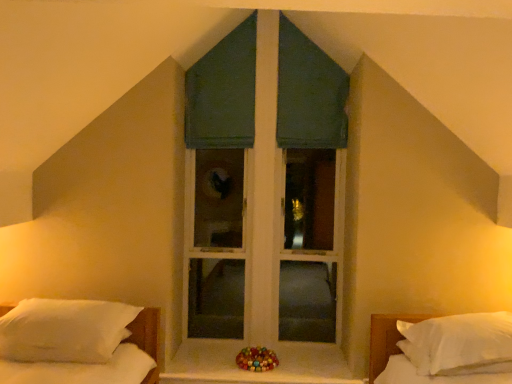
What do you see at coordinates (147, 331) in the screenshot? I see `white soft pillow at left, positioned as the 1th bed in left-to-right order` at bounding box center [147, 331].

The image size is (512, 384). Identify the location of white soft pillow at right, which is counted as the 2th bed, starting from the left. (445, 350).

What is the approximate height of white matte window sill at center?

white matte window sill at center is 3.71 centimeters tall.

Locate an element on the screen. white matte window sill at center is located at coordinates (257, 372).

Find the location of `shiny multicolored beads at center`. shiny multicolored beads at center is located at coordinates (257, 359).

Does white matte window sill at center appear on the left side of white soft pillow at left, the second bed in the right-to-left sequence?

Incorrect, white matte window sill at center is not on the left side of white soft pillow at left, the second bed in the right-to-left sequence.

Looking at their sizes, would you say white matte window sill at center is wider or thinner than white soft pillow at left, positioned as the 1th bed in left-to-right order?

Clearly, white matte window sill at center has less width compared to white soft pillow at left, positioned as the 1th bed in left-to-right order.

From the image's perspective, between white matte window sill at center and white soft pillow at left, positioned as the 1th bed in left-to-right order, who is located below?

white matte window sill at center.

Is shiny multicolored beads at center aimed at white soft pillow at right, which is counted as the 2th bed, starting from the left?

No, shiny multicolored beads at center does not turn towards white soft pillow at right, which is counted as the 2th bed, starting from the left.

From the image's perspective, which is below, shiny multicolored beads at center or white soft pillow at right, the 1th bed in the right-to-left sequence?

shiny multicolored beads at center is shown below in the image.

I want to click on the 2nd bed in front of the shiny multicolored beads at center, so click(x=445, y=350).

Does shiny multicolored beads at center have a greater height compared to white soft pillow at right, which is counted as the 2th bed, starting from the left?

In fact, shiny multicolored beads at center may be shorter than white soft pillow at right, which is counted as the 2th bed, starting from the left.

From their relative heights in the image, would you say white matte window sill at center is taller or shorter than green fabric window at center?

Clearly, white matte window sill at center is shorter compared to green fabric window at center.

From the image's perspective, would you say white matte window sill at center is shown under green fabric window at center?

Yes, from the image's perspective, white matte window sill at center is below green fabric window at center.

Would you say white matte window sill at center is outside green fabric window at center?

Yes, white matte window sill at center is located beyond the bounds of green fabric window at center.

Considering the relative sizes of white matte window sill at center and shiny multicolored beads at center in the image provided, is white matte window sill at center taller than shiny multicolored beads at center?

In fact, white matte window sill at center may be shorter than shiny multicolored beads at center.

Considering the points (301, 355) and (241, 365), which point is behind, point (301, 355) or point (241, 365)?

The point (301, 355) is farther from the camera.

Is white matte window sill at center not within shiny multicolored beads at center?

Absolutely, white matte window sill at center is external to shiny multicolored beads at center.

Looking at this image, does white matte window sill at center turn towards shiny multicolored beads at center?

No, white matte window sill at center does not turn towards shiny multicolored beads at center.

Between green fabric window at center and shiny multicolored beads at center, which one has smaller width?

With smaller width is green fabric window at center.

At what (x,y) coordinates should I click in order to perform the action: click on miniature on the left of green fabric window at center. Please return your answer as a coordinate pair (x, y). This screenshot has height=384, width=512. Looking at the image, I should click on (257, 359).

Is green fabric window at center not within shiny multicolored beads at center?

That's correct, green fabric window at center is outside of shiny multicolored beads at center.

Is green fabric window at center looking in the opposite direction of shiny multicolored beads at center?

No, shiny multicolored beads at center is not at the back of green fabric window at center.

Could you tell me if white soft pillow at right, which is counted as the 2th bed, starting from the left, is facing green fabric window at center?

No, white soft pillow at right, which is counted as the 2th bed, starting from the left, is not turned towards green fabric window at center.

Can you tell me how much white soft pillow at right, which is counted as the 2th bed, starting from the left, and green fabric window at center differ in facing direction?

144 degrees.

Which object is more forward, white soft pillow at right, which is counted as the 2th bed, starting from the left, or green fabric window at center?

white soft pillow at right, which is counted as the 2th bed, starting from the left, is closer to the camera.

Considering the relative sizes of white soft pillow at left, the second bed in the right-to-left sequence, and white matte window sill at center in the image provided, is white soft pillow at left, the second bed in the right-to-left sequence, smaller than white matte window sill at center?

No.

Which is behind, point (144, 326) or point (252, 372)?

Point (252, 372)

Which of these two, white soft pillow at left, positioned as the 1th bed in left-to-right order, or white matte window sill at center, stands taller?

Standing taller between the two is white soft pillow at left, positioned as the 1th bed in left-to-right order.

Image resolution: width=512 pixels, height=384 pixels. I want to click on window sill located behind the white soft pillow at left, the second bed in the right-to-left sequence, so click(257, 372).

Locate an element on the screen. miniature on the left of white soft pillow at right, which is counted as the 2th bed, starting from the left is located at coordinates (257, 359).

Which object lies further to the anchor point white soft pillow at right, the 1th bed in the right-to-left sequence, shiny multicolored beads at center or green fabric window at center?

Among the two, green fabric window at center is located further to white soft pillow at right, the 1th bed in the right-to-left sequence.

Which object lies nearer to the anchor point green fabric window at center, white matte window sill at center or white soft pillow at left, the second bed in the right-to-left sequence?

white matte window sill at center is closer to green fabric window at center.

When comparing their distances from shiny multicolored beads at center, does white soft pillow at left, positioned as the 1th bed in left-to-right order, or white soft pillow at right, the 1th bed in the right-to-left sequence, seem further?

Among the two, white soft pillow at right, the 1th bed in the right-to-left sequence, is located further to shiny multicolored beads at center.

From the image, which object appears to be farther from shiny multicolored beads at center, white soft pillow at right, the 1th bed in the right-to-left sequence, or white soft pillow at left, positioned as the 1th bed in left-to-right order?

→ white soft pillow at right, the 1th bed in the right-to-left sequence, lies further to shiny multicolored beads at center than the other object.

Which object lies further to the anchor point white soft pillow at left, positioned as the 1th bed in left-to-right order, white matte window sill at center or shiny multicolored beads at center?

shiny multicolored beads at center is further to white soft pillow at left, positioned as the 1th bed in left-to-right order.

From the picture: Which object lies further to the anchor point green fabric window at center, white soft pillow at right, the 1th bed in the right-to-left sequence, or white matte window sill at center?

white soft pillow at right, the 1th bed in the right-to-left sequence.

When comparing their distances from white matte window sill at center, does white soft pillow at left, the second bed in the right-to-left sequence, or white soft pillow at right, the 1th bed in the right-to-left sequence, seem closer?

The object closer to white matte window sill at center is white soft pillow at right, the 1th bed in the right-to-left sequence.

When comparing their distances from green fabric window at center, does white soft pillow at right, the 1th bed in the right-to-left sequence, or shiny multicolored beads at center seem further?

Based on the image, white soft pillow at right, the 1th bed in the right-to-left sequence, appears to be further to green fabric window at center.

You are a GUI agent. You are given a task and a screenshot of the screen. Output one action in this format:
    pyautogui.click(x=<x>, y=<y>)
    Task: Click on the miniature that lies between green fabric window at center and white matte window sill at center from top to bottom
    
    Given the screenshot: What is the action you would take?
    pyautogui.click(x=257, y=359)

Image resolution: width=512 pixels, height=384 pixels. I want to click on miniature located between white soft pillow at left, the second bed in the right-to-left sequence, and white matte window sill at center in the left-right direction, so tap(257, 359).

In order to click on window sill between shiny multicolored beads at center and white soft pillow at right, the 1th bed in the right-to-left sequence in this screenshot , I will do `click(257, 372)`.

Identify the location of window sill located between white soft pillow at left, positioned as the 1th bed in left-to-right order, and white soft pillow at right, which is counted as the 2th bed, starting from the left, in the left-right direction. The image size is (512, 384). (257, 372).